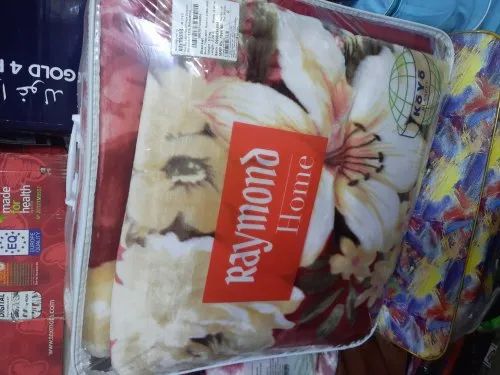
Find the location of a particular element. brown table is located at coordinates (x=386, y=357).